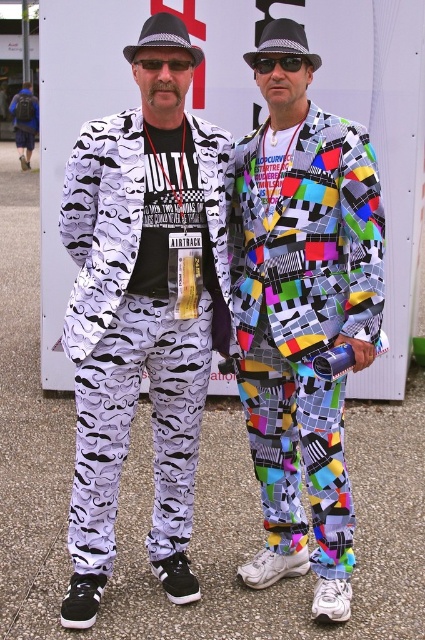
Question: Which of the following is the closest to the observer?

Choices:
 (A) white mustache-patterned suit at left
 (B) multicolored patchwork suit at center
 (C) black plastic sunglasses at center

Answer: (C)

Question: Does multicolored patchwork suit at center come in front of white mustache-patterned suit at left?

Choices:
 (A) no
 (B) yes

Answer: (B)

Question: Which point is farther to the camera?

Choices:
 (A) (218, 188)
 (B) (255, 566)

Answer: (B)

Question: Is multicolored patchwork suit at center below white mustache-patterned suit at left?

Choices:
 (A) yes
 (B) no

Answer: (B)

Question: Which object is closer to the camera taking this photo?

Choices:
 (A) multicolored patchwork suit at center
 (B) black plastic sunglasses at center

Answer: (B)

Question: Is multicolored patchwork suit at center above black plastic sunglasses at center?

Choices:
 (A) no
 (B) yes

Answer: (A)